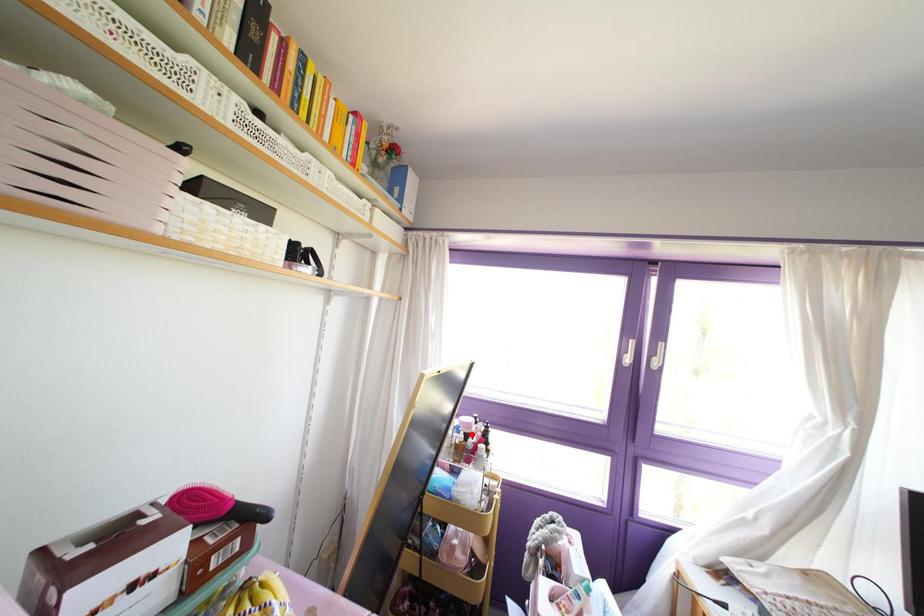
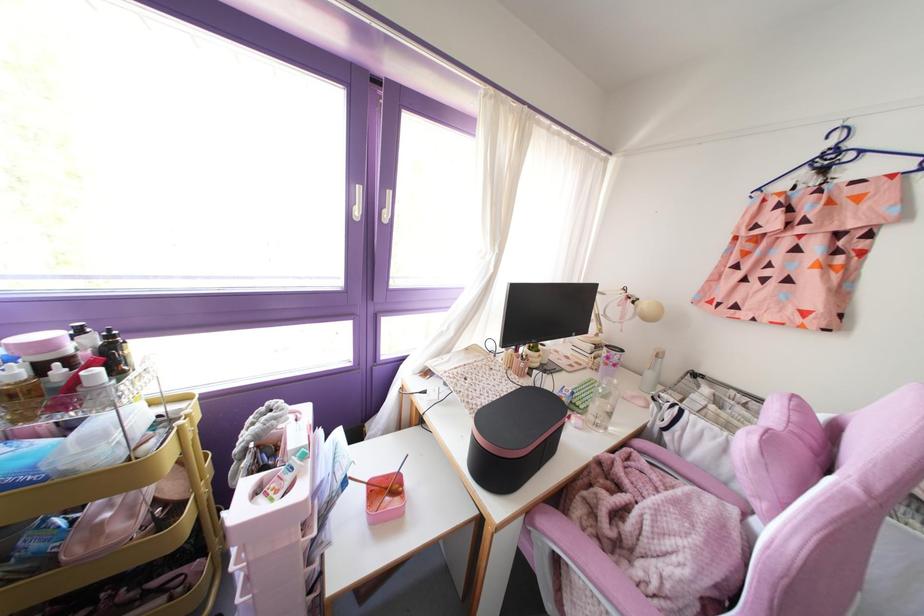
Find the pixel in the second image that matches the highlighted location in the first image.

(67, 360)